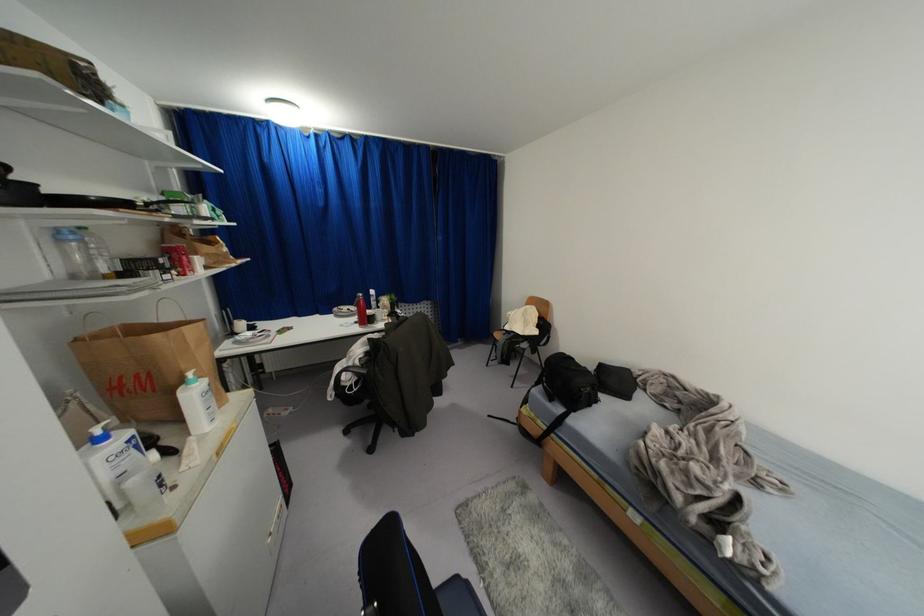
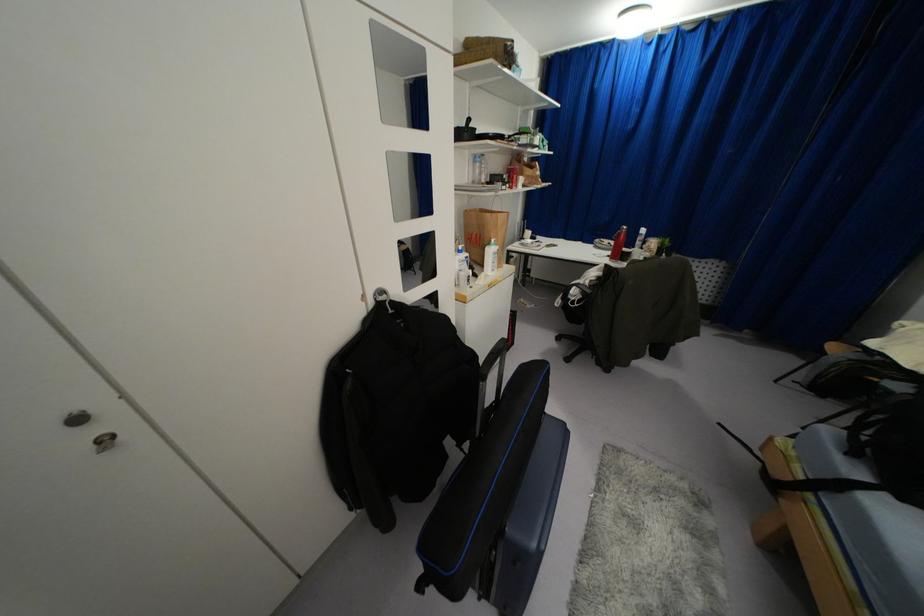
In the second image, find the point that corresponds to the point at 62,240 in the first image.

(475, 161)